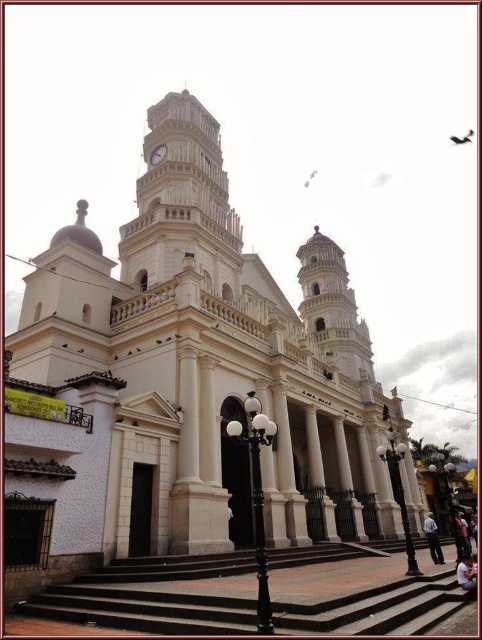
Question: Considering the real-world distances, which object is farthest from the white stone clock tower at upper left?

Choices:
 (A) black metal/texture lamp post at center
 (B) white glossy lamp post at lower right

Answer: (B)

Question: Does black metal/texture lamp post at center appear on the right side of polished brass lamp post at lower right?

Choices:
 (A) yes
 (B) no

Answer: (B)

Question: Which object appears closest to the camera in this image?

Choices:
 (A) white glossy lamp post at lower right
 (B) polished brass lamp post at lower right
 (C) white stone clock tower at upper left

Answer: (B)

Question: Is white stone clock tower at upper left bigger than polished brass lamp post at lower right?

Choices:
 (A) no
 (B) yes

Answer: (B)

Question: Which object appears closest to the camera in this image?

Choices:
 (A) white stone clock tower at upper left
 (B) polished brass lamp post at lower right
 (C) gold metallic clock at upper center

Answer: (B)

Question: In this image, where is black metal/texture lamp post at center located relative to polished brass lamp post at lower right?

Choices:
 (A) below
 (B) above

Answer: (B)